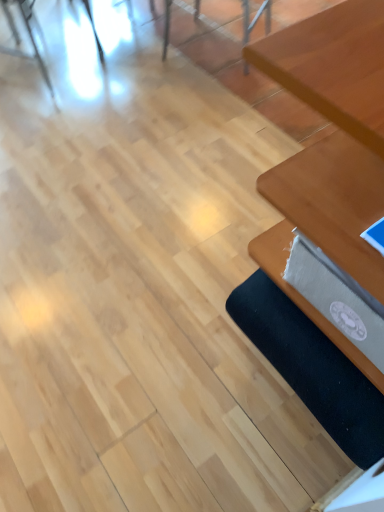
I want to click on free space to the right of metallic silver chair at upper left, which is the second chair from right to left, so click(132, 79).